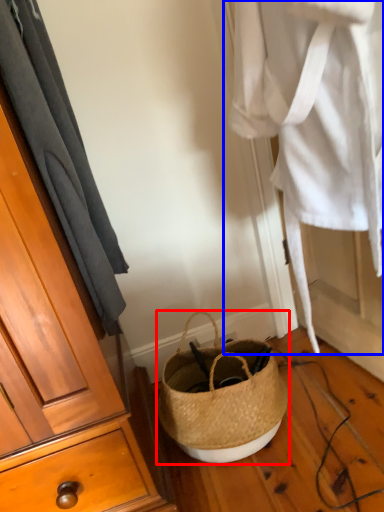
Question: Which object is closer to the camera taking this photo, handbag (highlighted by a red box) or clothing (highlighted by a blue box)?

Choices:
 (A) handbag
 (B) clothing

Answer: (B)